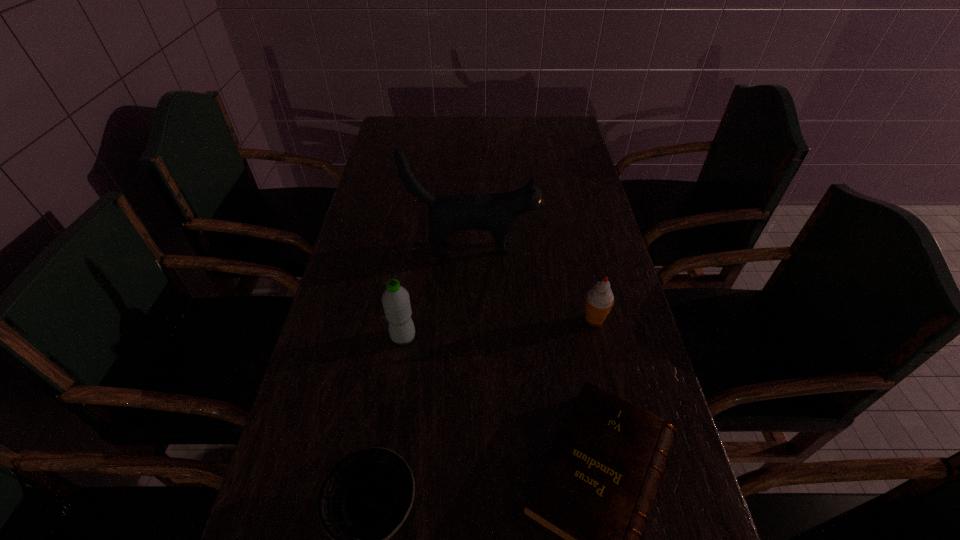
In order to click on free spot at the left edge of the desktop in this screenshot , I will do `click(367, 183)`.

At what (x,y) coordinates should I click in order to perform the action: click on free region at the right edge. Please return your answer as a coordinate pair (x, y). Looking at the image, I should click on (684, 472).

In the image, there is a desktop. Find the location of `vacant space at the far right corner`. vacant space at the far right corner is located at coordinates (556, 141).

At what (x,y) coordinates should I click in order to perform the action: click on vacant space that's between the second tallest object and the tallest object. Please return your answer as a coordinate pair (x, y). This screenshot has height=540, width=960. Looking at the image, I should click on (438, 293).

At what (x,y) coordinates should I click in order to perform the action: click on free point between the water bottle and the icecream. Please return your answer as a coordinate pair (x, y). The width and height of the screenshot is (960, 540). Looking at the image, I should click on (498, 329).

Locate which object ranks fourth in proximity to the shortest object. Please provide its 2D coordinates. Your answer should be formatted as a tuple, i.e. [(x, y)], where the tuple contains the x and y coordinates of a point satisfying the conditions above.

[(497, 212)]

Where is `object that stands as the fourth closest to the third shortest object`? Image resolution: width=960 pixels, height=540 pixels. object that stands as the fourth closest to the third shortest object is located at coordinates (363, 501).

You are a GUI agent. You are given a task and a screenshot of the screen. Output one action in this format:
    pyautogui.click(x=<x>, y=<y>)
    Task: Click on the vacant area in the image that satisfies the following two spatial constraints: 1. on the back side of the icecream; 2. at the face of the cat
    This screenshot has width=960, height=540.
    Given the screenshot: What is the action you would take?
    click(577, 248)

Image resolution: width=960 pixels, height=540 pixels. What are the coordinates of `vacant space that satisfies the following two spatial constraints: 1. on the back side of the icecream; 2. at the face of the tallest object` in the screenshot? It's located at (577, 248).

The height and width of the screenshot is (540, 960). I want to click on vacant area that satisfies the following two spatial constraints: 1. at the face of the cat; 2. on the right side of the icecream, so click(x=472, y=321).